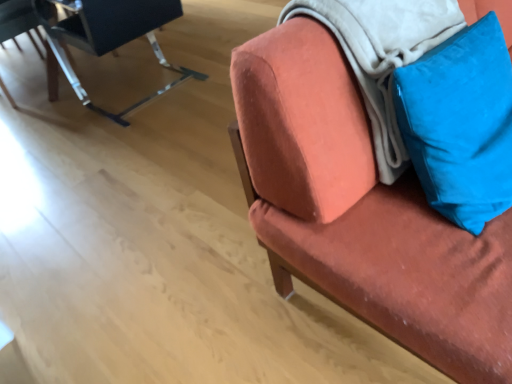
Question: In the image, is velvet orange chair at upper right, the 1th chair in the right-to-left sequence, positioned in front of or behind metallic black chair at upper left, the second chair from the left?

Choices:
 (A) behind
 (B) front

Answer: (B)

Question: In terms of size, does velvet orange chair at upper right, the 1th chair in the right-to-left sequence, appear bigger or smaller than metallic black chair at upper left, the second chair from the left?

Choices:
 (A) big
 (B) small

Answer: (A)

Question: Estimate the real-world distances between objects in this image. Which object is farther from the blue velvet pillow at upper right?

Choices:
 (A) soft white blanket at upper right
 (B) metallic black chair at upper left, the second chair from the left
 (C) velvet orange chair at upper right, which is the 3th chair in left-to-right order
 (D) metallic black chair at upper left, marked as the 1th chair in a left-to-right arrangement

Answer: (D)

Question: Which of these objects is positioned farthest from the metallic black chair at upper left, the 3th chair positioned from the right?

Choices:
 (A) soft white blanket at upper right
 (B) blue velvet pillow at upper right
 (C) velvet orange chair at upper right, which is the 3th chair in left-to-right order
 (D) metallic black chair at upper left, which appears as the second chair when viewed from the right

Answer: (B)